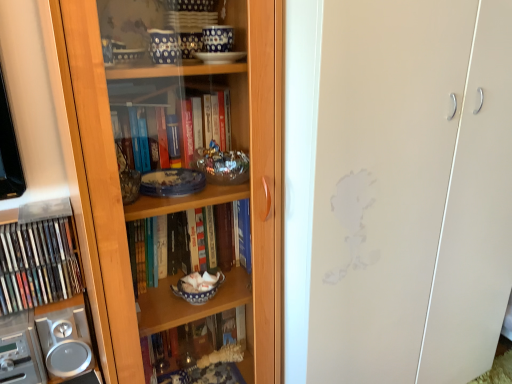
Question: Is transparent glass cabinet at center wider than matte plastic books at left?

Choices:
 (A) yes
 (B) no

Answer: (A)

Question: Is the position of transparent glass cabinet at center more distant than that of matte plastic books at left?

Choices:
 (A) no
 (B) yes

Answer: (A)

Question: From the image's perspective, does transparent glass cabinet at center appear higher than matte plastic books at left?

Choices:
 (A) no
 (B) yes

Answer: (B)

Question: From a real-world perspective, is transparent glass cabinet at center positioned over matte plastic books at left based on gravity?

Choices:
 (A) yes
 (B) no

Answer: (A)

Question: Would you say transparent glass cabinet at center contains matte plastic books at left?

Choices:
 (A) no
 (B) yes

Answer: (A)

Question: Is transparent glass cabinet at center to the right of matte plastic books at left from the viewer's perspective?

Choices:
 (A) no
 (B) yes

Answer: (B)

Question: Is transparent glass cabinet at center positioned beyond the bounds of silver metallic speaker at lower left?

Choices:
 (A) yes
 (B) no

Answer: (A)

Question: Does transparent glass cabinet at center have a larger size compared to silver metallic speaker at lower left?

Choices:
 (A) no
 (B) yes

Answer: (B)

Question: Is transparent glass cabinet at center facing towards silver metallic speaker at lower left?

Choices:
 (A) no
 (B) yes

Answer: (A)

Question: Is transparent glass cabinet at center in contact with silver metallic speaker at lower left?

Choices:
 (A) yes
 (B) no

Answer: (B)

Question: Does transparent glass cabinet at center have a greater width compared to silver metallic speaker at lower left?

Choices:
 (A) yes
 (B) no

Answer: (A)

Question: From the image's perspective, is transparent glass cabinet at center over silver metallic speaker at lower left?

Choices:
 (A) no
 (B) yes

Answer: (B)

Question: Can you confirm if matte plastic books at left is wider than transparent glass cabinet at center?

Choices:
 (A) no
 (B) yes

Answer: (A)